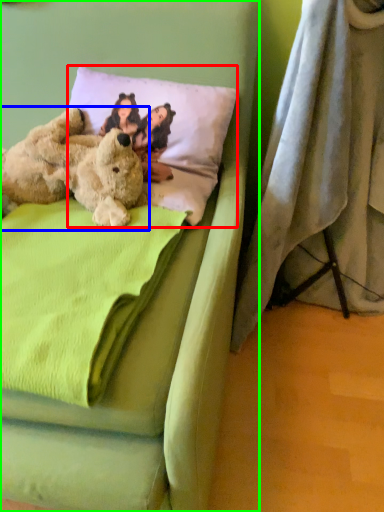
Question: Which is nearer to the pillow (highlighted by a red box)? teddy bear (highlighted by a blue box) or bed (highlighted by a green box).

Choices:
 (A) teddy bear
 (B) bed

Answer: (A)